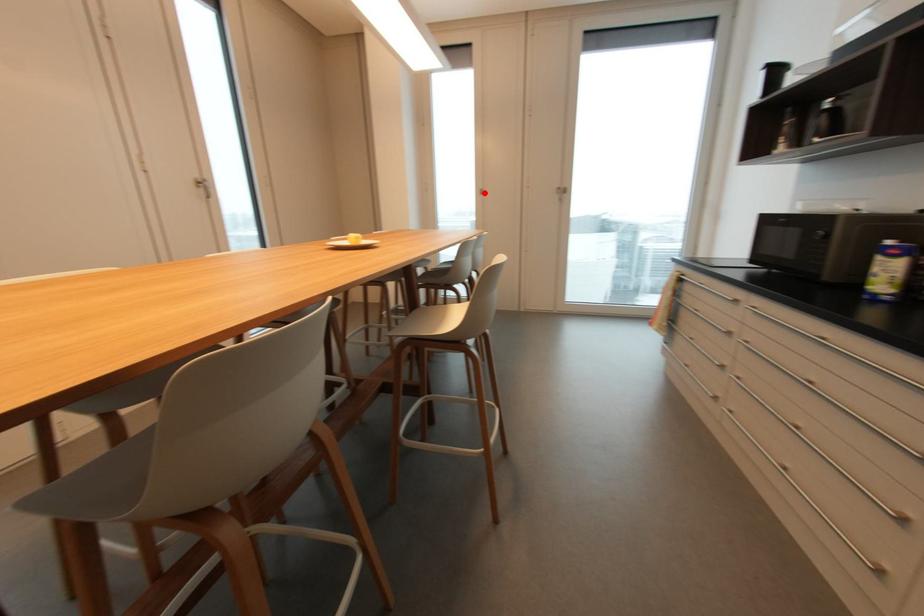
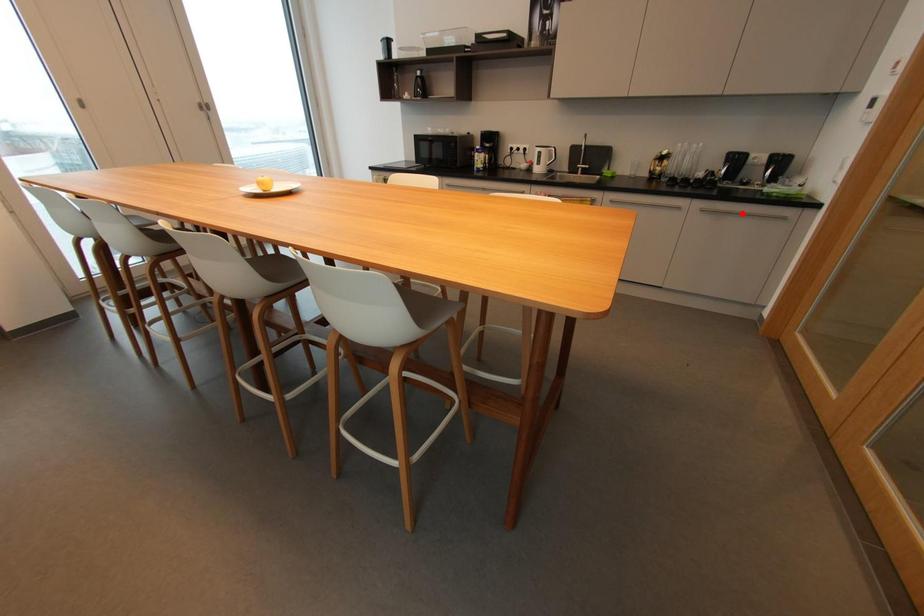
I am providing you with two images of the same scene from different viewpoints. A red point is marked on the first image and another point is marked on the second image. Are the points marked in image1 and image2 representing the same 3D position?

No